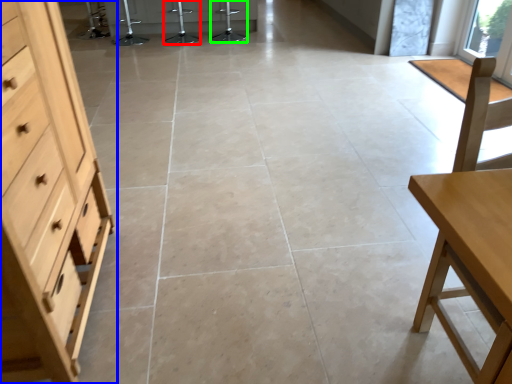
Question: Based on their relative distances, which object is nearer to bar stool (highlighted by a red box)? Choose from chest of drawers (highlighted by a blue box) and bar stool (highlighted by a green box).

Choices:
 (A) chest of drawers
 (B) bar stool

Answer: (B)